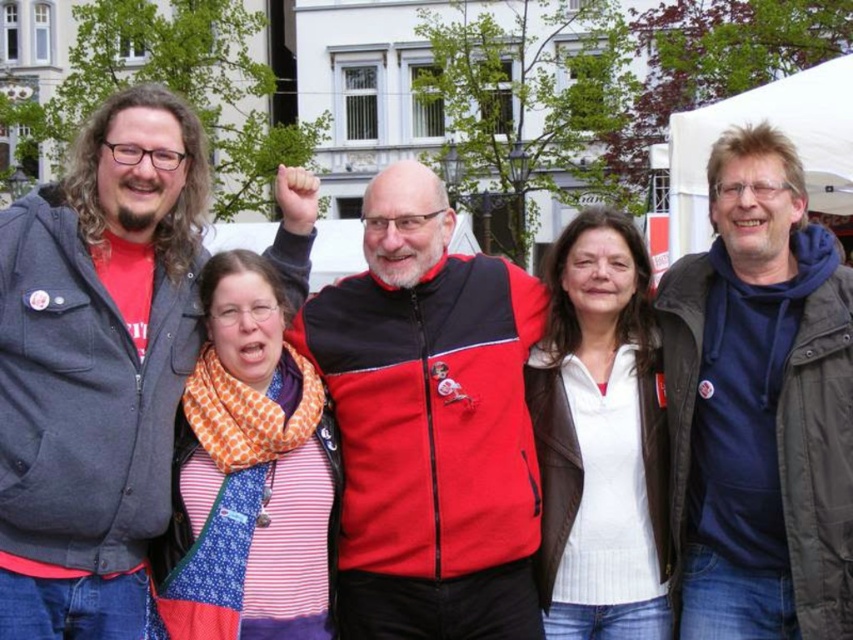
You are a photographer trying to capture a clear shot of the white matte jacket at center without the red fleece jacket at center blocking it. Based on the scene, is this possible?

The red fleece jacket at center is positioned over the white matte jacket at center, so it is blocking the view. To capture a clear shot of the white matte jacket at center without obstruction, you would need to adjust your angle or position to move around the red fleece jacket at center.

You are a fashion designer observing the group in the town square. You notice the matte gray jacket at left and the white matte jacket at center. Which jacket appears taller when viewed from the front?

The matte gray jacket at left appears taller than the white matte jacket at center.